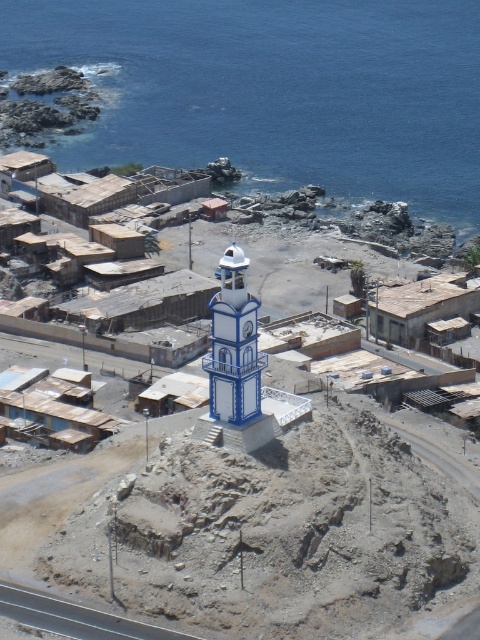
Looking at this image, can you confirm if blue water at upper center is taller than white painted brick bell tower at center?

Indeed, blue water at upper center has a greater height compared to white painted brick bell tower at center.

Is point (374, 77) in front of point (238, 307)?

No, (374, 77) is behind (238, 307).

Find the location of a particular element. blue water at upper center is located at coordinates (275, 92).

Between point (157, 284) and point (230, 259), which one is positioned behind?

Positioned behind is point (157, 284).

Where is `wooden shacks at center`? wooden shacks at center is located at coordinates (131, 308).

Is point (156, 397) in front of point (248, 260)?

No, it is behind (248, 260).

Where is `wooden shacks at center`? wooden shacks at center is located at coordinates (131, 308).

Between blue water at upper center and wooden shacks at center, which one is positioned higher?

blue water at upper center is higher up.

Between blue water at upper center and wooden shacks at center, which one has less height?

wooden shacks at center

What are the coordinates of `blue water at upper center` in the screenshot? It's located at (275, 92).